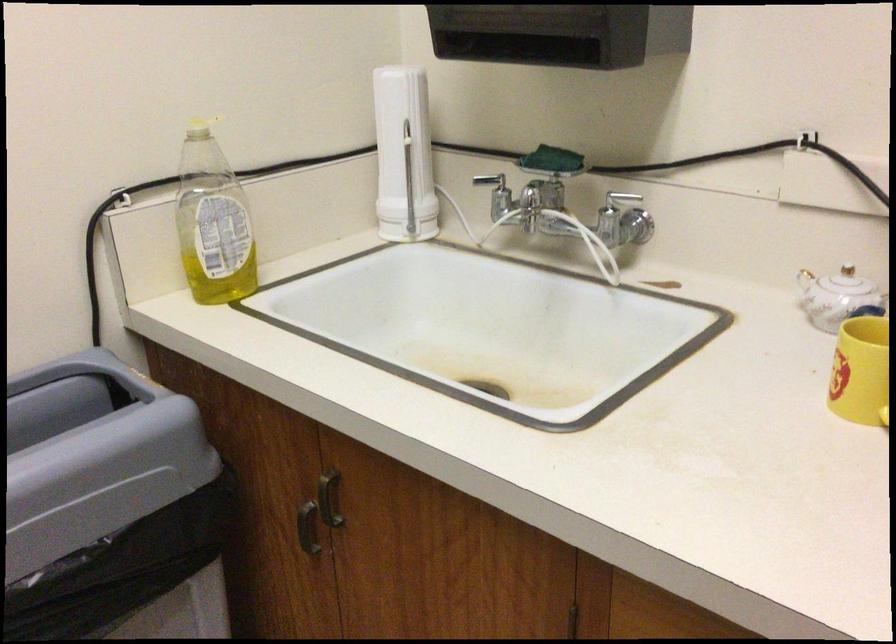
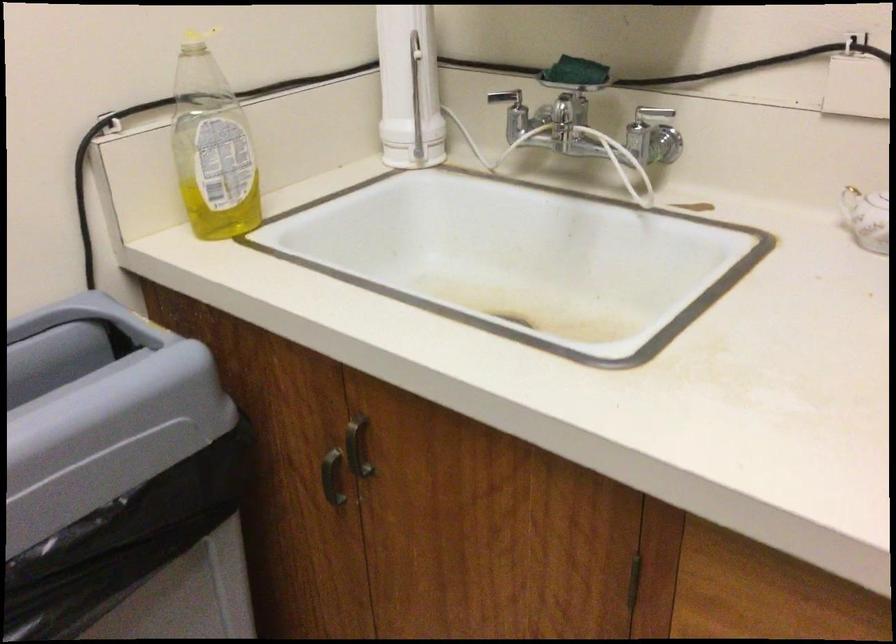
Based on the photo, what movement of the cameraman would produce the second image?

The movement direction of the cameraman is left, forward.